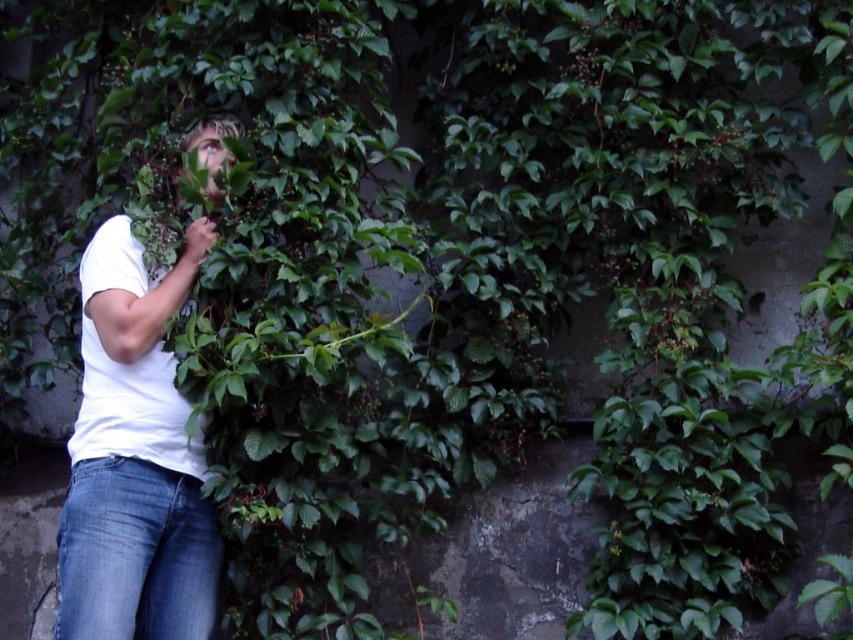
Who is higher up, white cotton shirt at left or white matte t-shirt at left?

Positioned higher is white matte t-shirt at left.

In the scene shown: Can you confirm if white cotton shirt at left is bigger than white matte t-shirt at left?

Correct, white cotton shirt at left is larger in size than white matte t-shirt at left.

This screenshot has width=853, height=640. What do you see at coordinates (134, 458) in the screenshot?
I see `white cotton shirt at left` at bounding box center [134, 458].

Identify the location of white cotton shirt at left. The height and width of the screenshot is (640, 853). (134, 458).

Is white cotton shirt at left below denim jeans at lower left?

No, white cotton shirt at left is not below denim jeans at lower left.

Is white cotton shirt at left wider than denim jeans at lower left?

Yes.

This screenshot has width=853, height=640. I want to click on white cotton shirt at left, so click(x=134, y=458).

Does denim jeans at lower left appear over white matte t-shirt at left?

Actually, denim jeans at lower left is below white matte t-shirt at left.

Locate an element on the screen. The width and height of the screenshot is (853, 640). denim jeans at lower left is located at coordinates (136, 554).